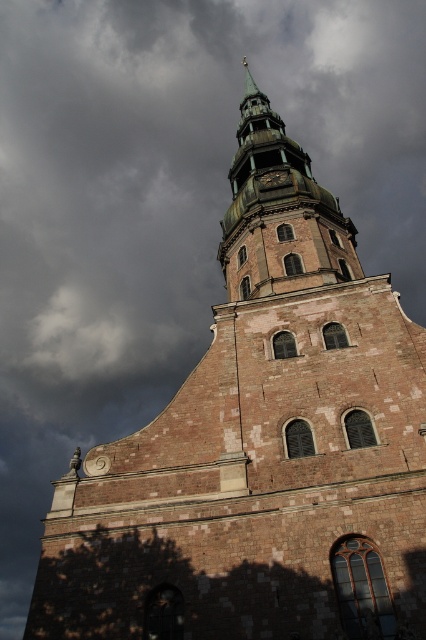
You are an architect assessing the church structure. You notice the brick steeple at upper center and the dark brown wooden clock at center. Which structure would require more materials to construct based on their sizes?

The brick steeple at upper center is bigger than the dark brown wooden clock at center, so it would require more materials to construct.

You are a photographer trying to capture the entire structure of the brick steeple at upper center and the dark brown wooden clock at center in a single shot. Given that your camera can only focus on one object at a time, which object should you prioritize focusing on to ensure it appears clearer in the photo?

The brick steeple at upper center is much taller than the dark brown wooden clock at center, so you should prioritize focusing on the brick steeple at upper center to ensure it appears clearer in the photo.